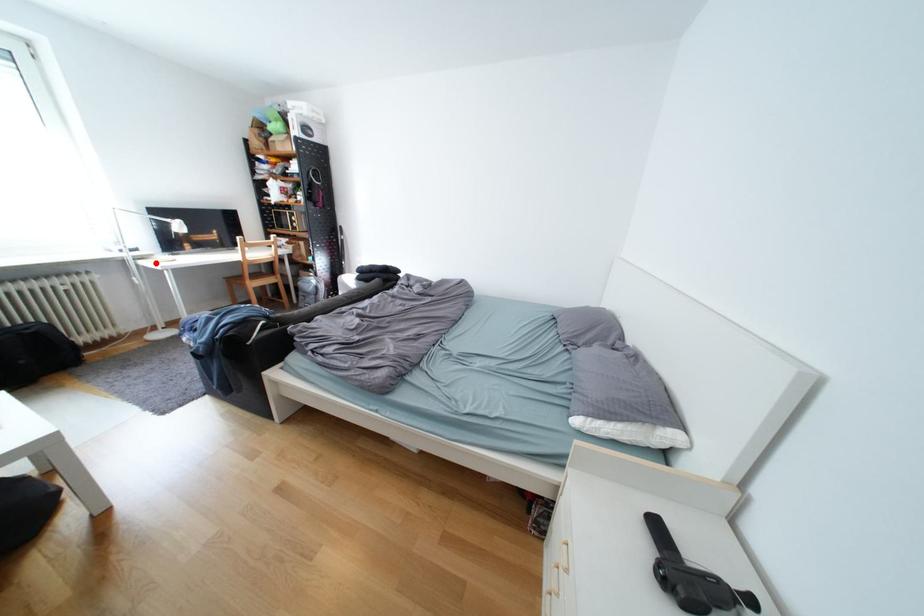
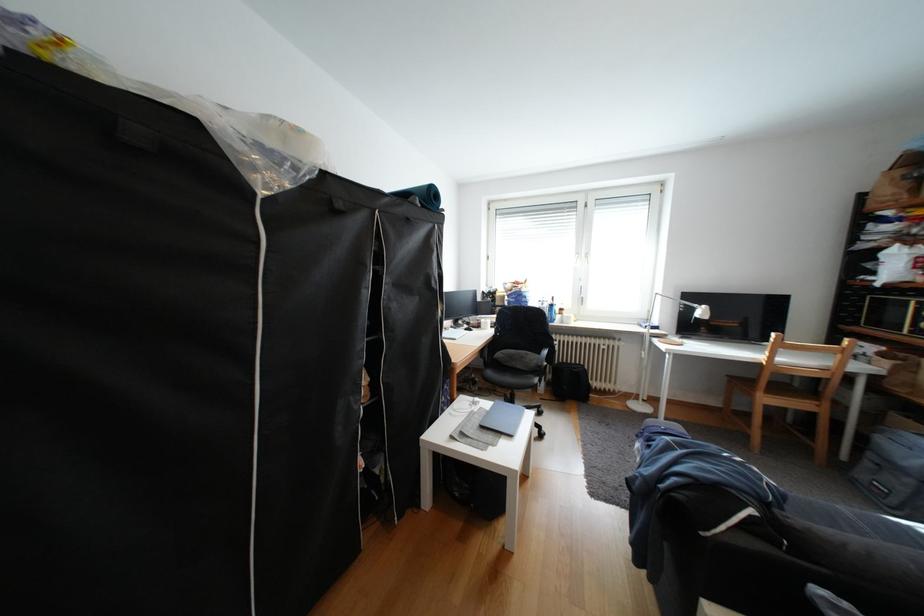
Question: I am providing you with two images of the same scene from different viewpoints. A red point is marked on the first image. At the location where the point appears in image 1, is it still visible in image 2?

Choices:
 (A) Yes
 (B) No

Answer: (A)